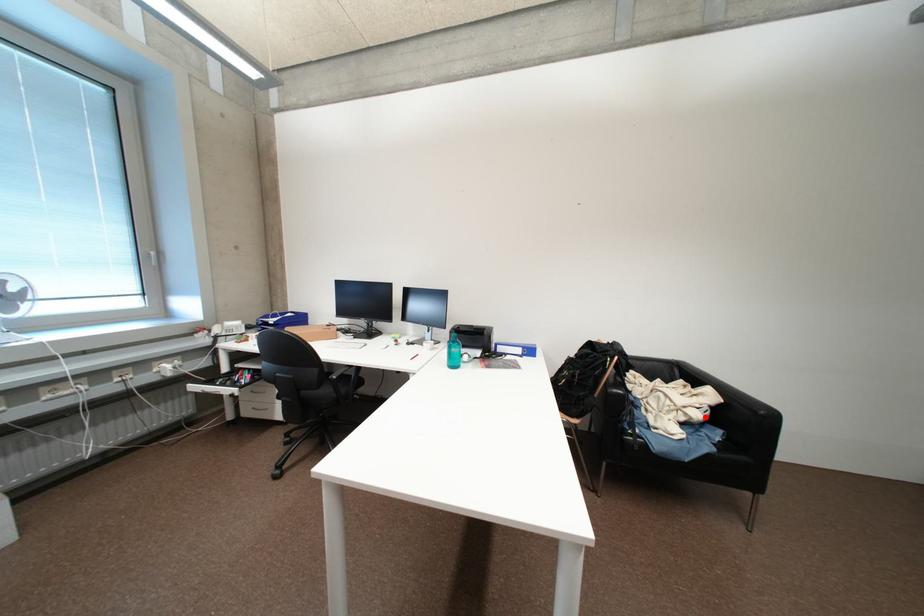
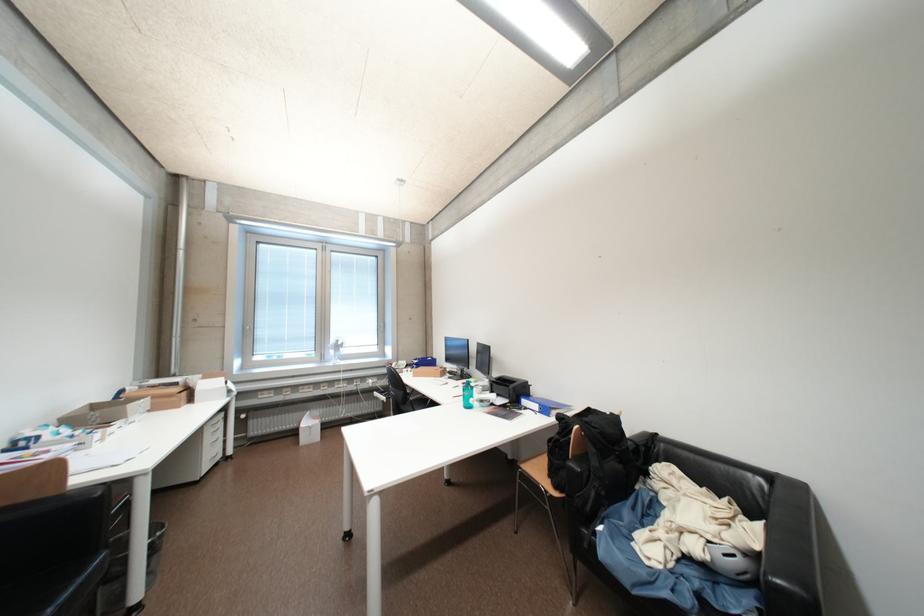
Question: I am providing you with two images of the same scene from different viewpoints. A red point is shown in image1. For the corresponding object point in image2, is it positioned nearer or farther from the camera?

Choices:
 (A) Nearer
 (B) Farther

Answer: (A)